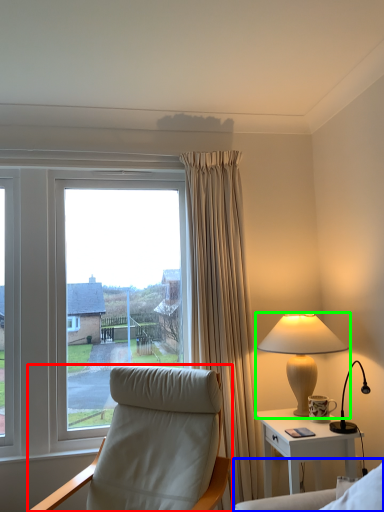
Question: Considering the real-world distances, which object is farthest from chair (highlighted by a red box)? couch (highlighted by a blue box) or lamp (highlighted by a green box)?

Choices:
 (A) couch
 (B) lamp

Answer: (B)